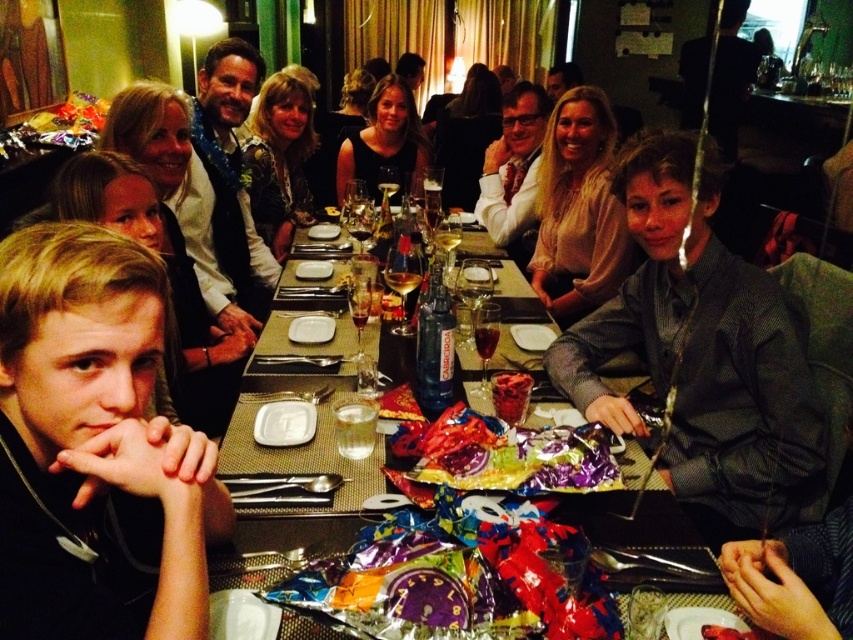
Does light beige blouse at upper center appear over white plastic plate at center?

Yes, light beige blouse at upper center is above white plastic plate at center.

Between light beige blouse at upper center and white plastic plate at center, which one has less height?

With less height is white plastic plate at center.

Between point (585, 218) and point (285, 428), which one is positioned in front?

Point (285, 428)

Image resolution: width=853 pixels, height=640 pixels. I want to click on light beige blouse at upper center, so click(578, 211).

Is black matte shirt at left bigger than shiny metallic table at center?

No, black matte shirt at left is not bigger than shiny metallic table at center.

Which is above, black matte shirt at left or shiny metallic table at center?

Positioned higher is black matte shirt at left.

Locate an element on the screen. black matte shirt at left is located at coordinates point(91,444).

Can you confirm if shiny metallic table at center is taller than matte black dress at center?

No.

Locate an element on the screen. This screenshot has height=640, width=853. shiny metallic table at center is located at coordinates (279, 545).

Who is more forward, (257, 541) or (300, 104)?

Point (257, 541)

Locate an element on the screen. shiny metallic table at center is located at coordinates (279, 545).